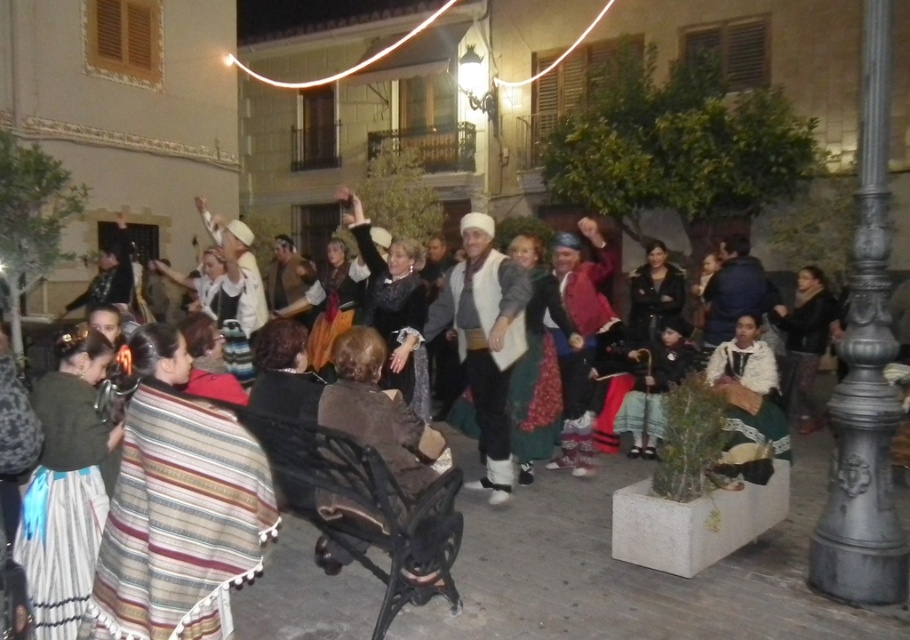
Question: Which is nearer to the white woolen sweater at center?

Choices:
 (A) matte black dress at center
 (B) white lace dress at lower right

Answer: (A)

Question: Which point is closer to the camera?

Choices:
 (A) (261, 582)
 (B) (776, 456)
 (C) (428, 339)

Answer: (A)

Question: From the image, what is the correct spatial relationship of matte black dress at center in relation to white woolen sweater at center?

Choices:
 (A) left
 (B) right

Answer: (B)

Question: Among these points, which one is farthest from the camera?

Choices:
 (A) click(x=767, y=348)
 (B) click(x=492, y=442)
 (C) click(x=747, y=548)

Answer: (A)

Question: Is the position of matte black dress at center more distant than that of white lace dress at lower right?

Choices:
 (A) yes
 (B) no

Answer: (B)

Question: Does matte black dress at center appear on the right side of white lace dress at lower right?

Choices:
 (A) yes
 (B) no

Answer: (B)